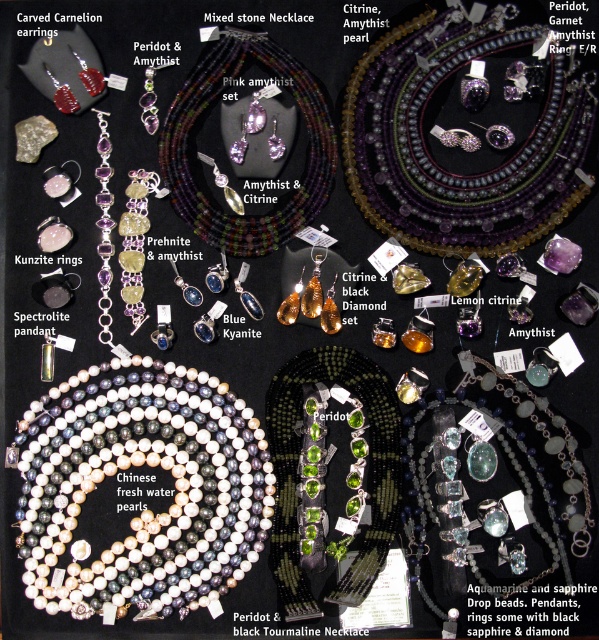
Question: Which point is closer to the camera taking this photo?

Choices:
 (A) click(x=491, y=368)
 (B) click(x=208, y=92)

Answer: (B)

Question: In this image, where is white pearl necklace at center located relative to purple beaded necklace at upper center?

Choices:
 (A) above
 (B) below

Answer: (B)

Question: Is mixed stonematerial/texturenecklace at upper center below aquamarinesapphire drop beads at center?

Choices:
 (A) yes
 (B) no

Answer: (B)

Question: Can you confirm if purple beaded necklace at upper center is positioned above aquamarinesapphire drop beads at center?

Choices:
 (A) yes
 (B) no

Answer: (A)

Question: Which of the following is the farthest from the observer?

Choices:
 (A) (512, 400)
 (B) (240, 244)
 (C) (379, 148)

Answer: (B)

Question: Which object is farther from the camera taking this photo?

Choices:
 (A) purple beaded necklace at upper center
 (B) mixed stonematerial/texturenecklace at upper center
 (C) aquamarinesapphire drop beads at center
 (D) white pearl necklace at center

Answer: (B)